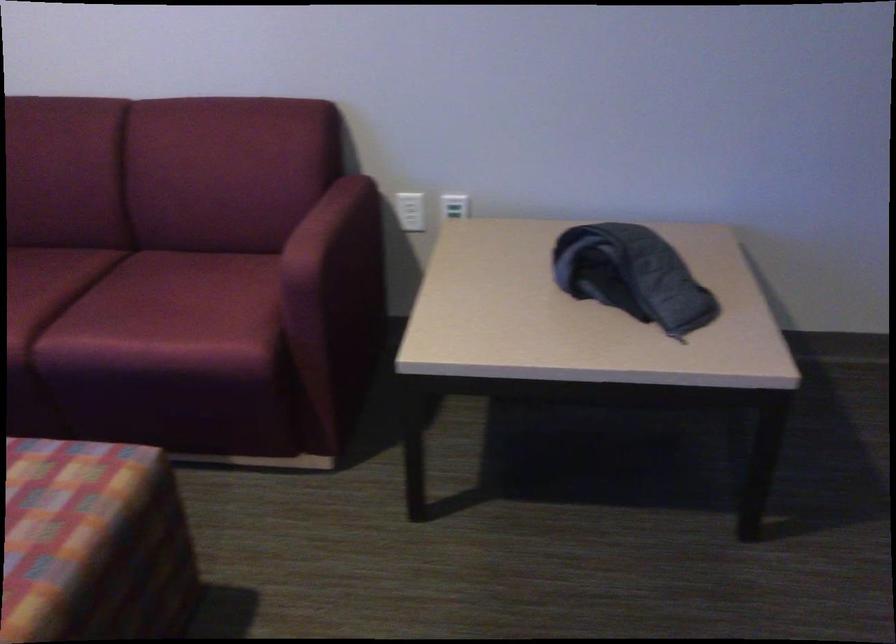
Find the location of a particular element. sofa sitting surface is located at coordinates (175, 290).